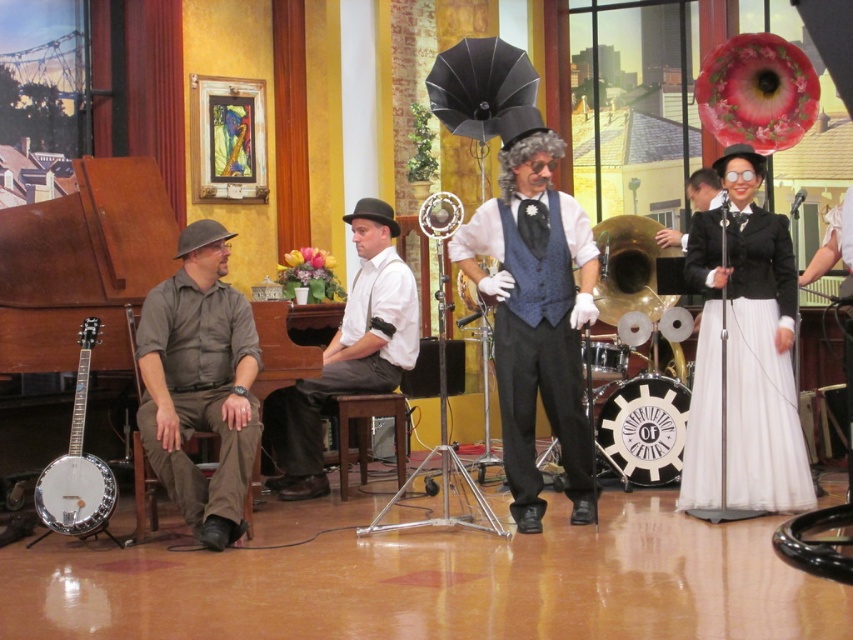
You are a photographer at the event and want to capture a photo where the blue textured vest at center and the silver metallic banjo at left are both clearly visible. Which object should you focus on first to ensure both are in frame?

The blue textured vest at center is above the silver metallic banjo at left, so focusing on the blue textured vest at center first will ensure both objects are in frame as the banjo is below it.

You are a photographer at the event and want to capture both the khaki cotton shirt at left and the white cotton shirt at center in the same frame. Based on their positions, which shirt should you focus on first to ensure both are in focus?

The khaki cotton shirt at left is positioned under the white cotton shirt at center, so focusing on the white cotton shirt at center first would help ensure both are in focus since it is closer to the camera.

You are a photographer positioned at the center of the image. You want to take a photo that includes both the khaki cotton shirt at left and the banjo leaning against the chair. Where should you position your camera to ensure both are in frame?

The khaki cotton shirt at left is located at point (200,384). To include both the khaki cotton shirt at left and the banjo leaning against the chair in the photo, position the camera centrally so that both objects are within the frame.